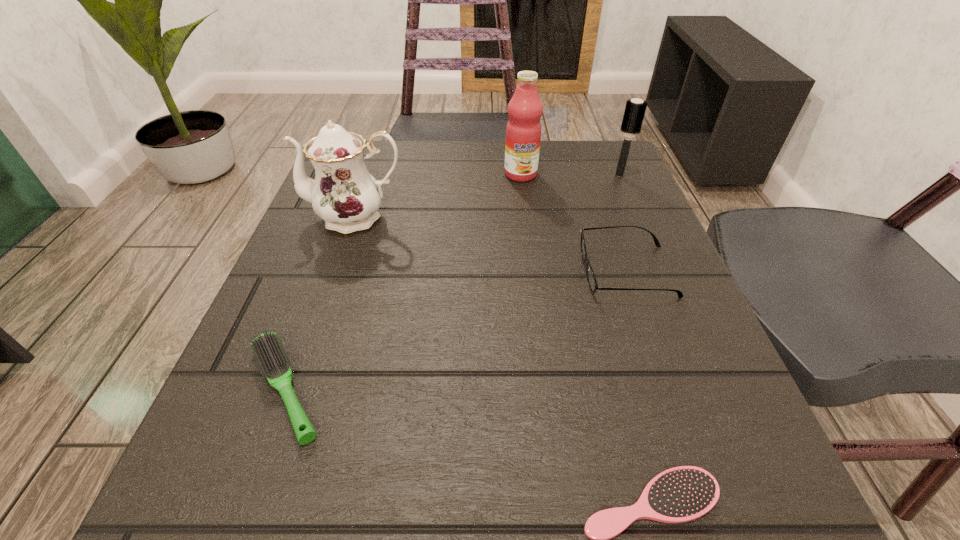
The height and width of the screenshot is (540, 960). In the image, there is a desktop. In order to click on vacant space at the near right corner in this screenshot , I will do `click(738, 489)`.

In order to click on unoccupied area between the second farthest hairbrush and the fruit juice in this screenshot , I will do `click(403, 281)`.

The width and height of the screenshot is (960, 540). What are the coordinates of `free space between the second nearest hairbrush and the rightmost hairbrush` in the screenshot? It's located at (452, 282).

Identify the location of vacant region between the third farthest object and the fruit juice. (439, 195).

This screenshot has height=540, width=960. I want to click on unoccupied position between the chinaware and the farthest hairbrush, so click(x=488, y=196).

In order to click on vacant region between the tallest hairbrush and the second farthest hairbrush in this screenshot , I will do `click(452, 282)`.

Locate an element on the screen. Image resolution: width=960 pixels, height=540 pixels. free space between the fruit juice and the spectacles is located at coordinates [x=574, y=222].

Find the location of a particular element. This screenshot has width=960, height=540. free spot between the chinaware and the leftmost hairbrush is located at coordinates (321, 302).

Locate an element on the screen. This screenshot has height=540, width=960. blank region between the chinaware and the farthest hairbrush is located at coordinates (488, 196).

You are a GUI agent. You are given a task and a screenshot of the screen. Output one action in this format:
    pyautogui.click(x=<x>, y=<y>)
    Task: Click on the third closest object to the rightmost hairbrush
    
    Given the screenshot: What is the action you would take?
    344,194